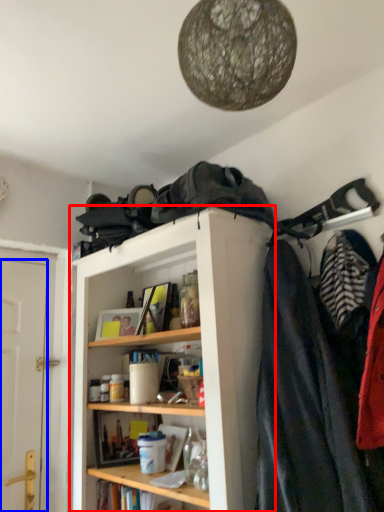
Question: Which object is further to the camera taking this photo, shelf (highlighted by a red box) or door (highlighted by a blue box)?

Choices:
 (A) shelf
 (B) door

Answer: (B)